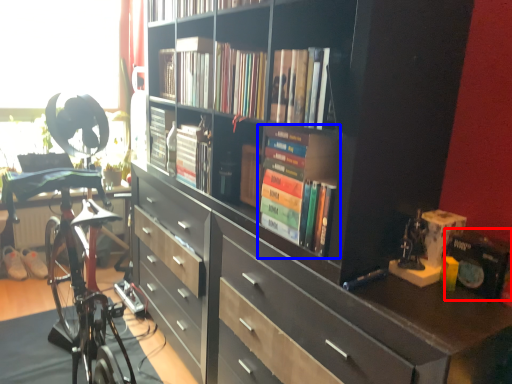
Question: Which of the following is the farthest to the observer, paperback book (highlighted by a red box) or book (highlighted by a blue box)?

Choices:
 (A) paperback book
 (B) book

Answer: (B)